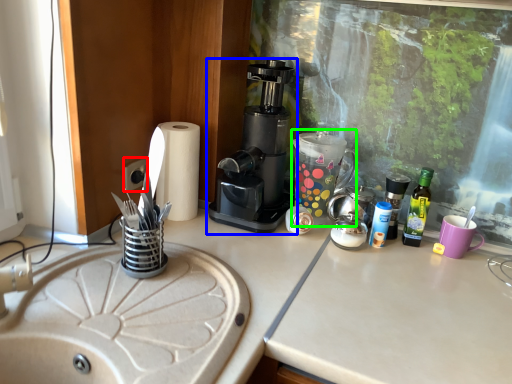
Question: Considering the real-world distances, which object is closest to electric outlet (highlighted by a red box)? coffee maker (highlighted by a blue box) or coffeepot (highlighted by a green box).

Choices:
 (A) coffee maker
 (B) coffeepot

Answer: (A)